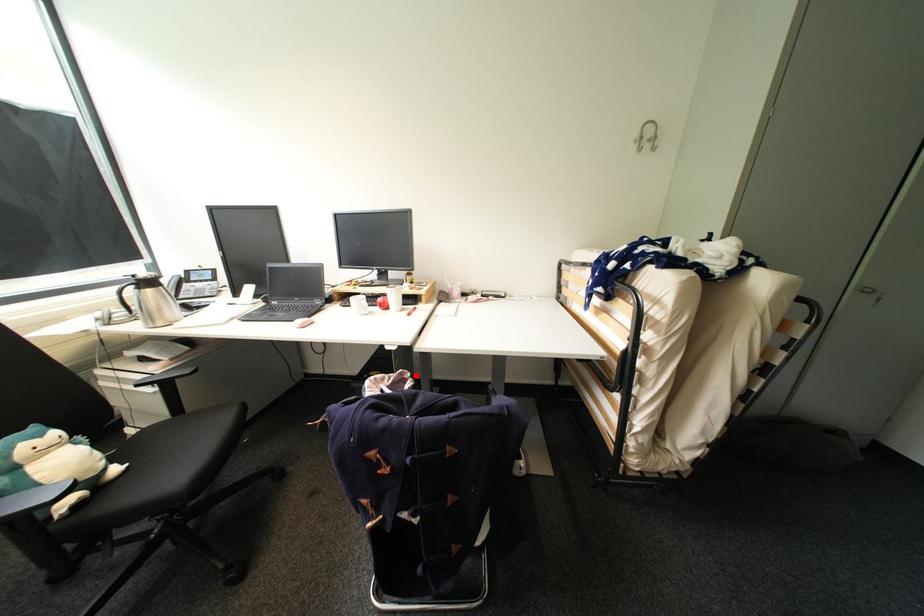
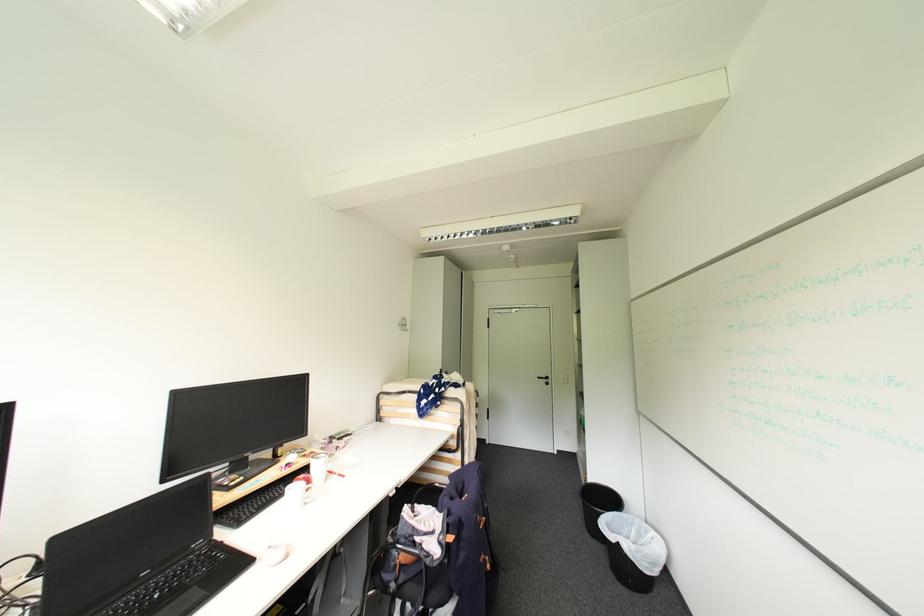
Question: I am providing you with two images of the same scene from different viewpoints. A red point is marked on the first image. Is the red point's position out of view in image 2?

Choices:
 (A) Yes
 (B) No

Answer: (B)